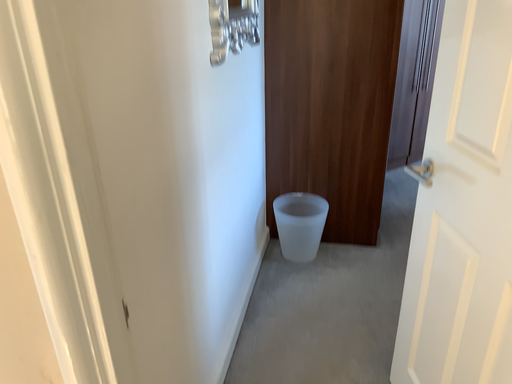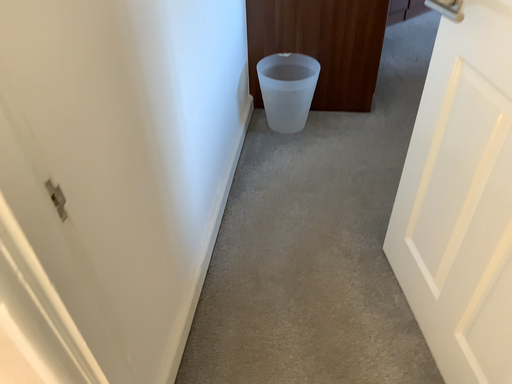
Question: How did the camera likely rotate when shooting the video?

Choices:
 (A) rotated upward
 (B) rotated downward

Answer: (B)